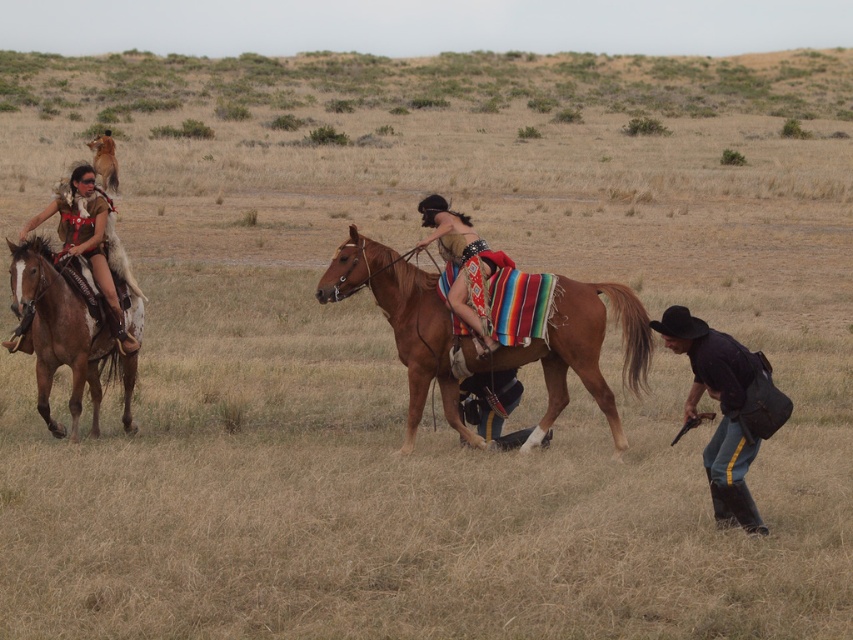
Is point (56, 355) positioned before point (107, 136)?

Yes, it is in front of point (107, 136).

Can you confirm if brown leather horse at left is positioned above brown leather horse at upper left?

Actually, brown leather horse at left is below brown leather horse at upper left.

The image size is (853, 640). I want to click on brown leather horse at left, so click(x=62, y=336).

You are a GUI agent. You are given a task and a screenshot of the screen. Output one action in this format:
    pyautogui.click(x=<x>, y=<y>)
    Task: Click on the brown leather horse at left
    The height and width of the screenshot is (640, 853).
    Given the screenshot: What is the action you would take?
    pyautogui.click(x=62, y=336)

Between matte brown leather horse at left and brown leather horse at upper left, which one is positioned lower?

matte brown leather horse at left is lower down.

Does matte brown leather horse at left have a lesser height compared to brown leather horse at upper left?

Yes, matte brown leather horse at left is shorter than brown leather horse at upper left.

Is point (64, 241) positioned before point (102, 134)?

Yes, it is.

This screenshot has width=853, height=640. In order to click on matte brown leather horse at left in this screenshot , I will do `click(86, 243)`.

Which of these two, brown leather horse at center or brown leather horse at upper left, stands taller?

brown leather horse at upper left

Is brown leather horse at center positioned in front of brown leather horse at upper left?

Yes, brown leather horse at center is in front of brown leather horse at upper left.

Is point (418, 348) closer to viewer compared to point (112, 154)?

Yes, it is.

Where is `brown leather horse at center`? brown leather horse at center is located at coordinates (579, 352).